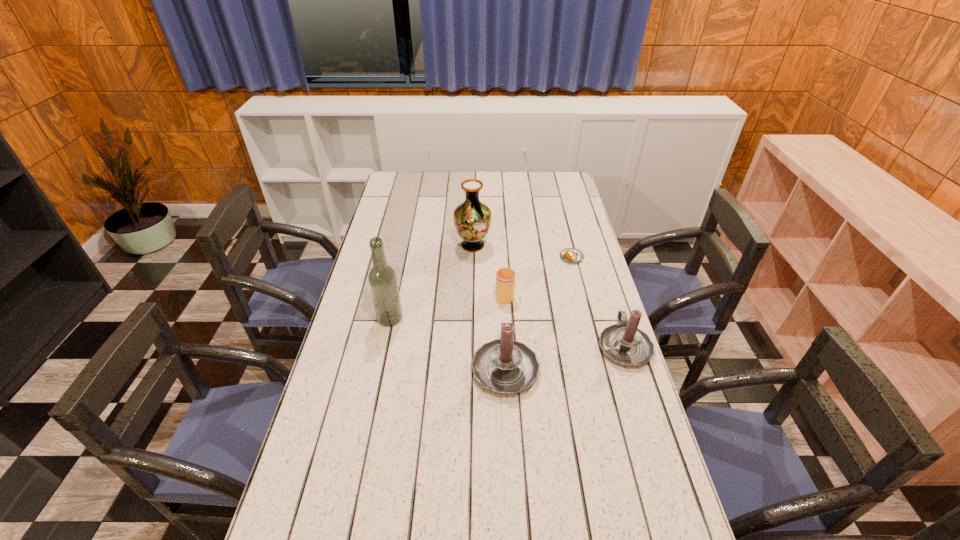
Please point a free position for a candle on the left. Please provide its 2D coordinates. Your answer should be formatted as a tuple, i.e. [(x, y)], where the tuple contains the x and y coordinates of a point satisfying the conditions above.

[(374, 390)]